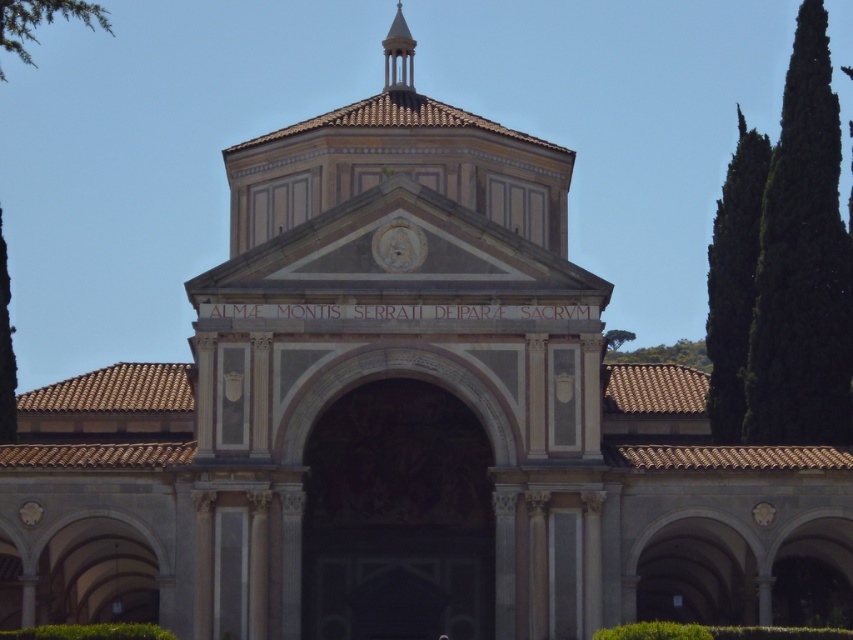
Does dark green leafy tree at right appear on the left side of green leafy tree at upper right?

No, dark green leafy tree at right is not to the left of green leafy tree at upper right.

Can you confirm if dark green leafy tree at right is taller than green leafy tree at upper right?

Correct, dark green leafy tree at right is much taller as green leafy tree at upper right.

Who is more distant from viewer, (788,266) or (691,364)?

Point (691,364)

Where is `dark green leafy tree at right`? dark green leafy tree at right is located at coordinates (802, 264).

Does dark green leafy tree at right come in front of green leafy tree at right?

Yes.

Who is positioned more to the left, dark green leafy tree at right or green leafy tree at right?

From the viewer's perspective, dark green leafy tree at right appears more on the left side.

This screenshot has height=640, width=853. I want to click on dark green leafy tree at right, so click(x=802, y=264).

Consider the image. Can you confirm if dark green leafy tree at right is bigger than green leafy tree at left?

No.

Is point (834, 291) positioned before point (7, 307)?

Yes, it is in front of point (7, 307).

This screenshot has width=853, height=640. Identify the location of dark green leafy tree at right. (802, 264).